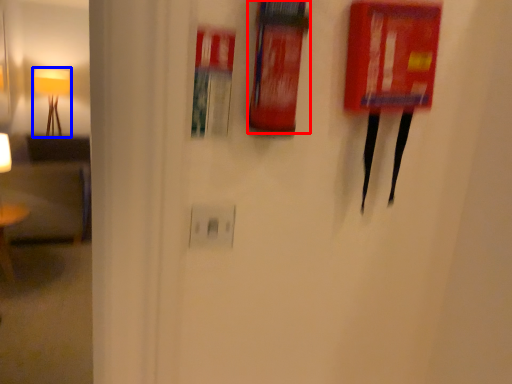
Question: Which object is closer to the camera taking this photo, extinguisher (highlighted by a red box) or lamp (highlighted by a blue box)?

Choices:
 (A) extinguisher
 (B) lamp

Answer: (A)